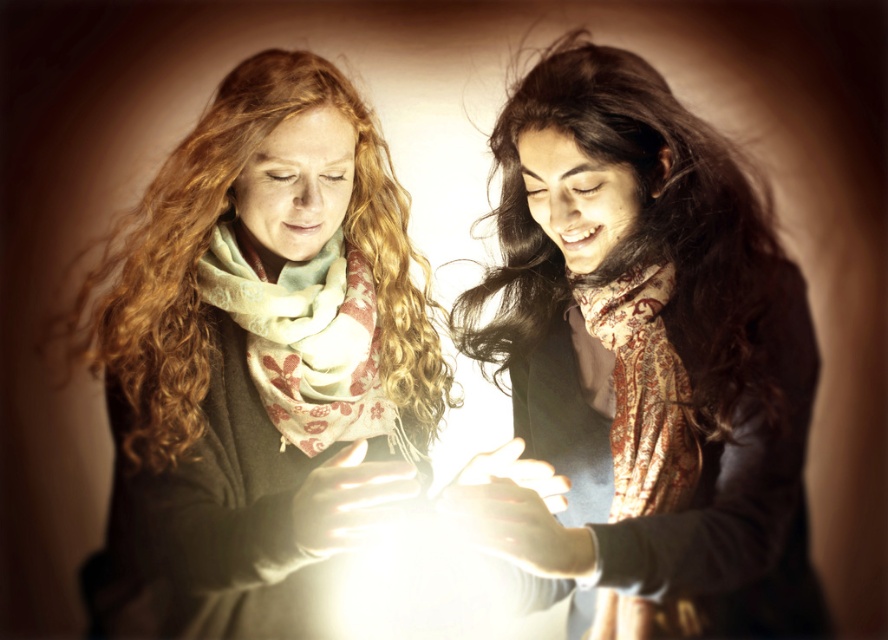
Question: Which of the following is the farthest from the observer?

Choices:
 (A) patterned silk scarf at right
 (B) brown paisley scarf at center
 (C) light green floral scarf at center

Answer: (C)

Question: Does matte green scarf at center come behind brown paisley scarf at center?

Choices:
 (A) yes
 (B) no

Answer: (B)

Question: Is matte green scarf at center positioned at the back of light green floral scarf at center?

Choices:
 (A) yes
 (B) no

Answer: (B)

Question: Among these objects, which one is nearest to the camera?

Choices:
 (A) matte green scarf at center
 (B) brown paisley scarf at center
 (C) patterned silk scarf at right
 (D) light green floral scarf at center

Answer: (A)

Question: Can you confirm if matte green scarf at center is positioned below light green floral scarf at center?

Choices:
 (A) no
 (B) yes

Answer: (B)

Question: Which object appears farthest from the camera in this image?

Choices:
 (A) light green floral scarf at center
 (B) brown paisley scarf at center
 (C) matte green scarf at center

Answer: (A)